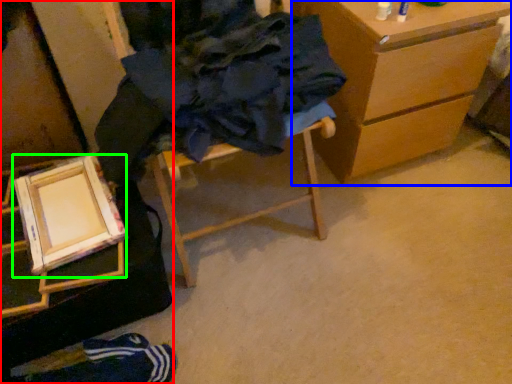
Question: Considering the real-world distances, which object is closest to furniture (highlighted by a red box)? chest of drawers (highlighted by a blue box) or picture frame (highlighted by a green box).

Choices:
 (A) chest of drawers
 (B) picture frame

Answer: (B)